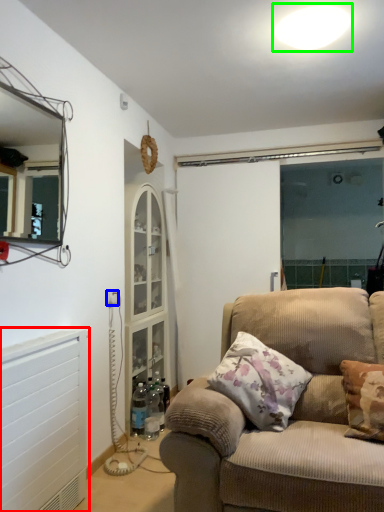
Question: Estimate the real-world distances between objects in this image. Which object is farther from radiator (highlighted by a red box), electric outlet (highlighted by a blue box) or light (highlighted by a green box)?

Choices:
 (A) electric outlet
 (B) light

Answer: (B)